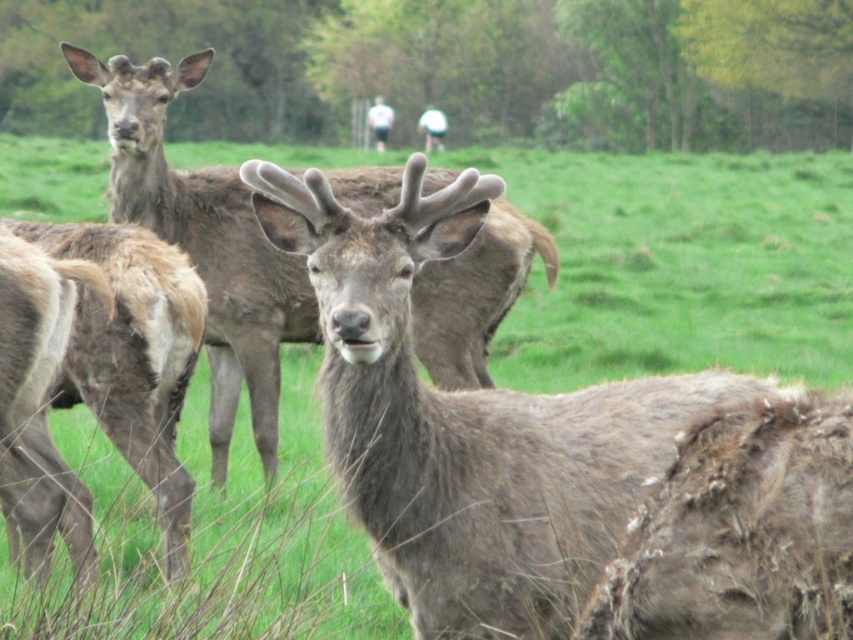
In the scene shown: You are a wildlife photographer observing the scene. You notice the brown fur antlered deer at center and the gray fur deer at center. Which deer is closer to you?

The brown fur antlered deer at center is closer to you because it is in front of the gray fur deer at center.

You are observing a group of deer in a grassy field. You notice a brown fur antlered deer at center and a gray fur deer at center. Which deer is positioned to the right of the other?

The brown fur antlered deer at center is to the right of the gray fur deer at center.